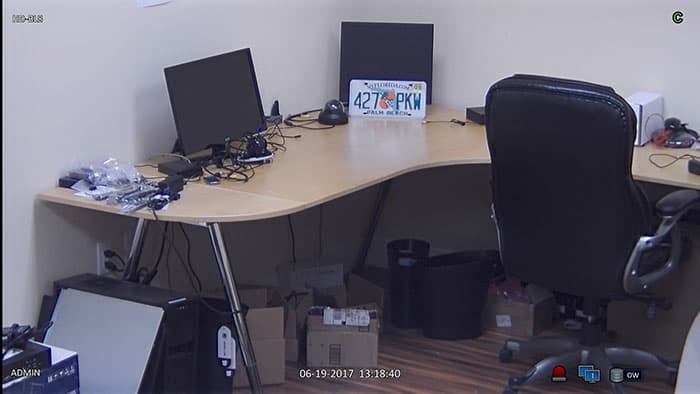
The height and width of the screenshot is (394, 700). I want to click on wall, so click(538, 25), click(106, 92).